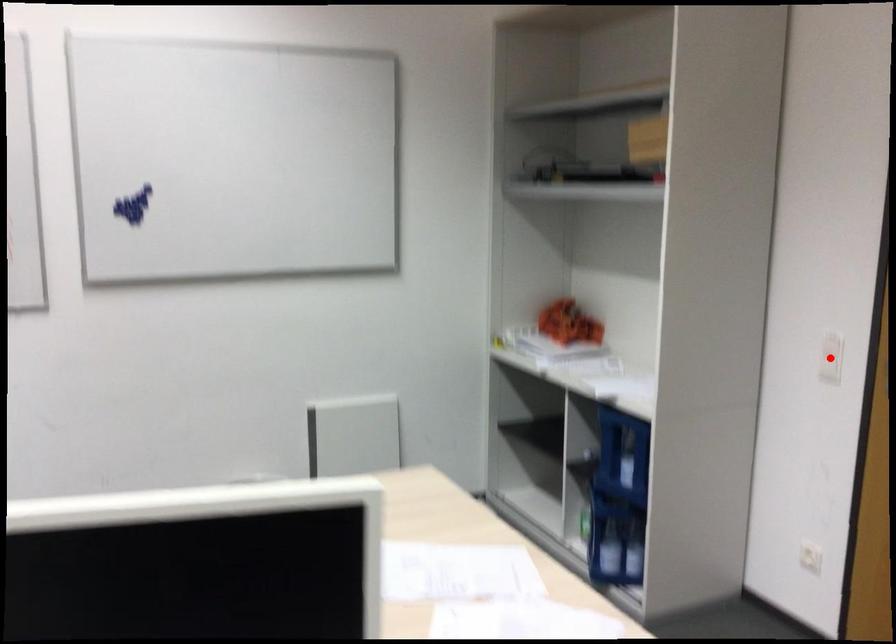
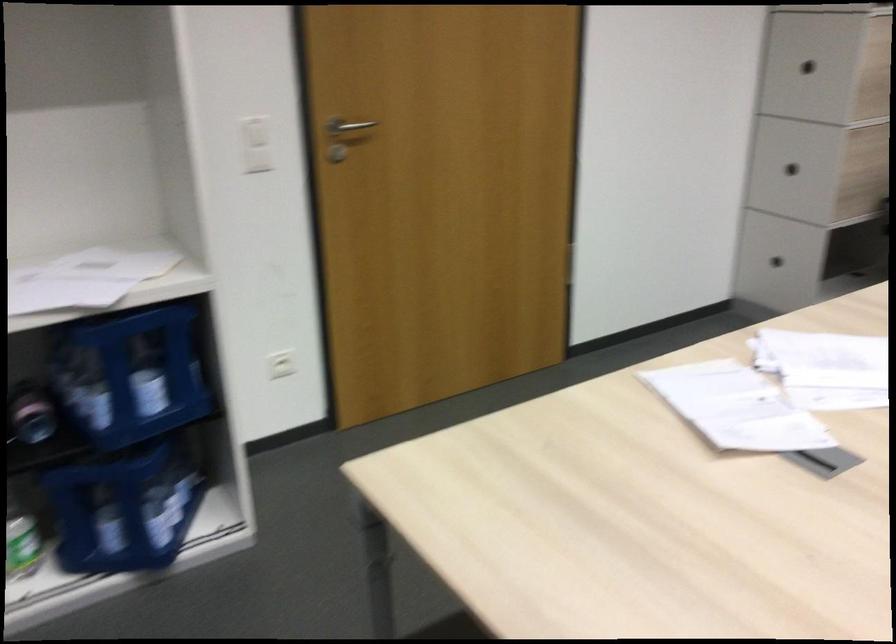
Question: I am providing you with two images of the same scene from different viewpoints. A red point is marked on the first image. At the location where the point appears in image 1, is it still visible in image 2?

Choices:
 (A) Yes
 (B) No

Answer: (B)